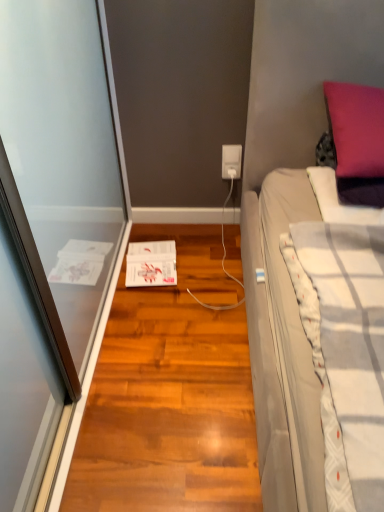
Question: From a real-world perspective, is white plastic power outlet at center physically located above or below shiny brown hardwood floor at center?

Choices:
 (A) below
 (B) above

Answer: (B)

Question: From the image's perspective, is white plastic power outlet at center above or below shiny brown hardwood floor at center?

Choices:
 (A) above
 (B) below

Answer: (A)

Question: Which of these objects is positioned closest to the shiny brown hardwood floor at center?

Choices:
 (A) white textured blanket at right
 (B) white plastic power outlet at center
 (C) purple velvet pillow at upper right

Answer: (A)

Question: Which object is positioned closest to the shiny brown hardwood floor at center?

Choices:
 (A) white textured blanket at right
 (B) white plastic power outlet at center
 (C) purple velvet pillow at upper right

Answer: (A)